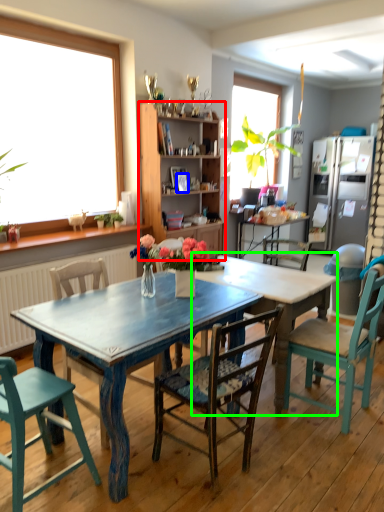
Question: Which is farther away from cabinetry (highlighted by a red box)? picture frame (highlighted by a blue box) or table (highlighted by a green box)?

Choices:
 (A) picture frame
 (B) table

Answer: (B)